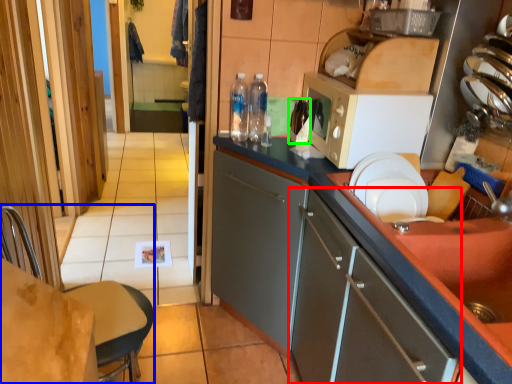
Question: Which object is positioned closest to cabinetry (highlighted by a red box)? Select from chair (highlighted by a blue box) and bottle (highlighted by a green box).

Choices:
 (A) chair
 (B) bottle

Answer: (A)